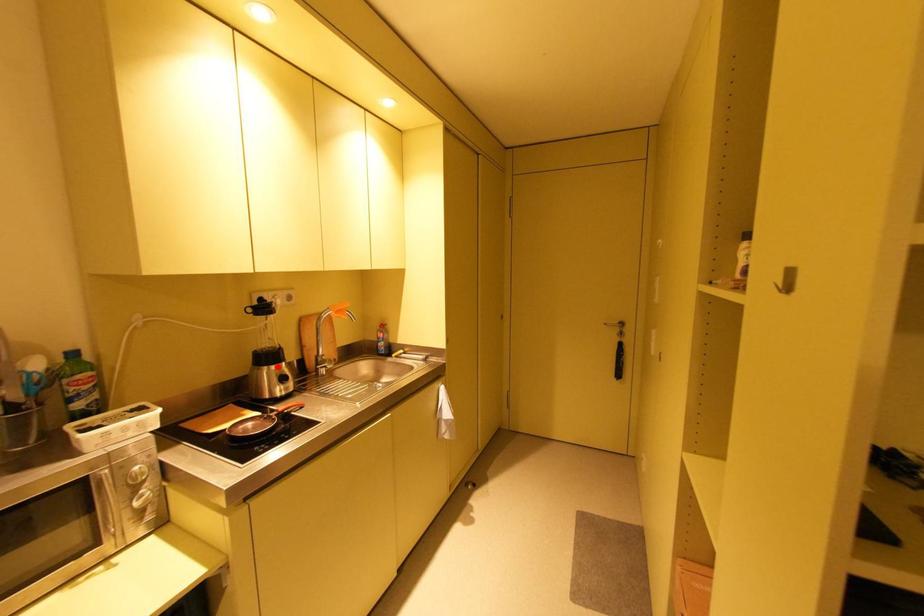
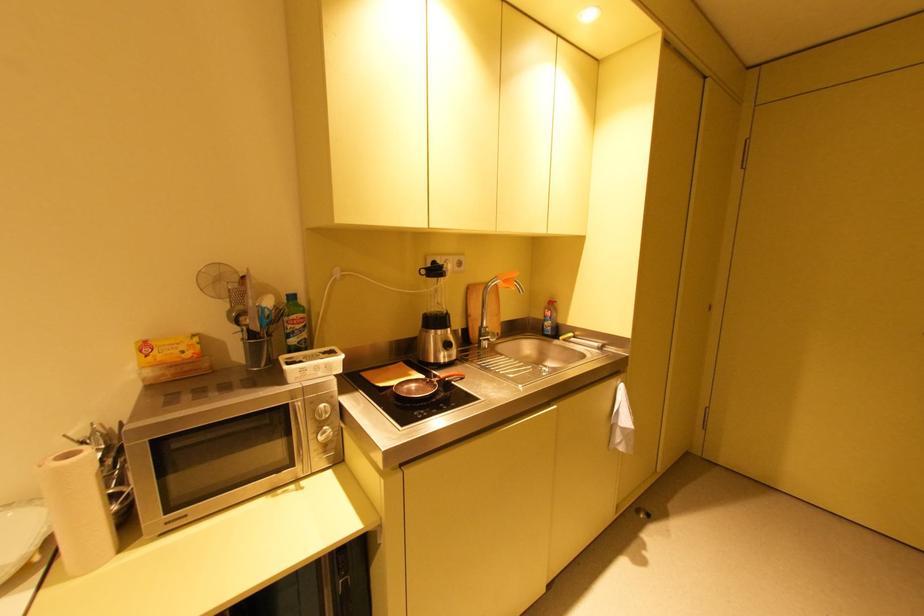
Where in the second image is the point corresponding to the highlighted location from the first image?

(444, 331)